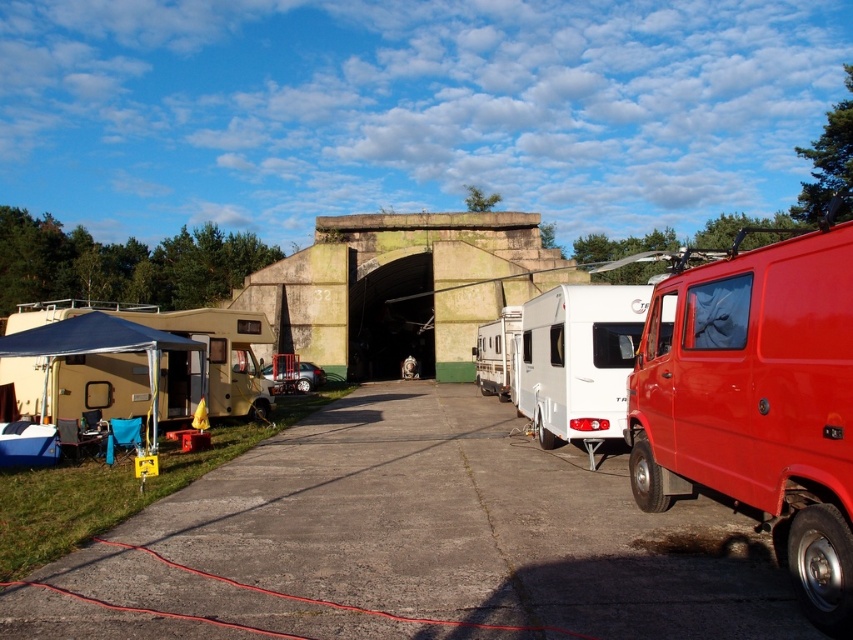
You are standing at the entrance of the hangar and want to walk to the beige camper. There are two points marked on the ground in front of you. One is at point [764,390] and the other is at point [608,304]. Which point should you step on first to reach the beige camper?

You should step on point [764,390] first because it is in front of point [608,304], meaning it is closer to your starting position at the hangar entrance.

From the picture: You are standing at the point marked by the coordinates point (757,397) in the image. Looking around, you see a shiny red van at right and a beige camper. Which vehicle is closer to your current position?

The point (757,397) indicates the shiny red van at right, so you are already at the location of the shiny red van at right. Therefore, the shiny red van at right is at your current position, making it the closest vehicle to you.

You are standing at the entrance of the hangar and want to park your car in the parking lot. The entrance is located at coordinate point 0.5, 0.5. Which vehicle, the shiny red van at right or the beige camper, is closer to the entrance?

The shiny red van at right is closer to the entrance because it is at point (757, 397), which is closer to the entrance at (426, 320) than the beige camper, which is not mentioned in the objects description.